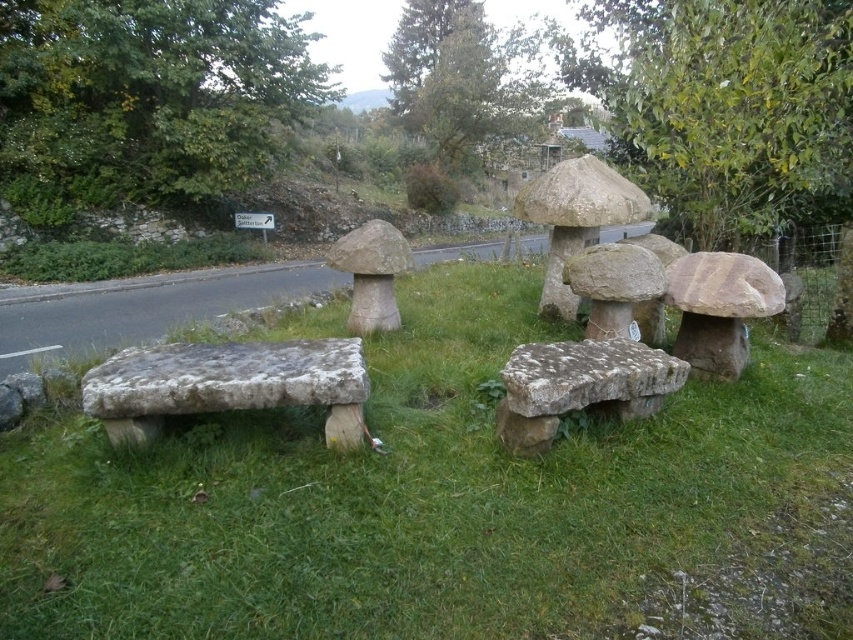
Is point (337, 381) less distant than point (514, 449)?

That is True.

Does gray stone bench at lower left lie behind speckled stone bench at center?

No, gray stone bench at lower left is closer to the viewer.

Where is `gray stone bench at lower left`? gray stone bench at lower left is located at coordinates (228, 385).

Does green mossy stone bench at center have a lesser width compared to gray stone bench at lower left?

Incorrect, green mossy stone bench at center's width is not less than gray stone bench at lower left's.

Does point (215, 560) come in front of point (344, 364)?

That is True.

Identify the location of green mossy stone bench at center. (445, 506).

Measure the distance between point (349, 524) and camera.

Point (349, 524) and camera are 2.40 meters apart from each other.

Which is more to the left, green mossy stone bench at center or speckled stone bench at center?

From the viewer's perspective, green mossy stone bench at center appears more on the left side.

Where is `green mossy stone bench at center`? Image resolution: width=853 pixels, height=640 pixels. green mossy stone bench at center is located at coordinates (445, 506).

Where is `green mossy stone bench at center`? green mossy stone bench at center is located at coordinates (445, 506).